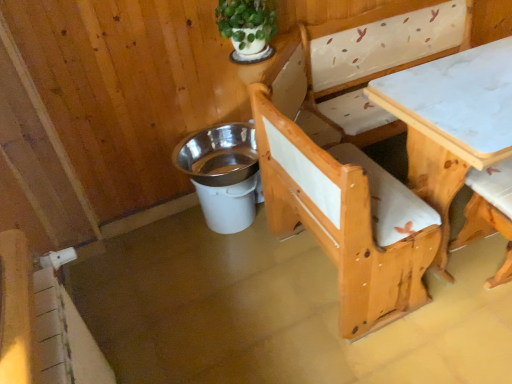
Question: From the image's perspective, is white plastic bucket at lower center located above green matte plant at upper center?

Choices:
 (A) yes
 (B) no

Answer: (B)

Question: From a real-world perspective, is white plastic bucket at lower center on green matte plant at upper center?

Choices:
 (A) yes
 (B) no

Answer: (B)

Question: Can you confirm if white plastic bucket at lower center is smaller than green matte plant at upper center?

Choices:
 (A) no
 (B) yes

Answer: (A)

Question: Can you confirm if white plastic bucket at lower center is thinner than green matte plant at upper center?

Choices:
 (A) yes
 (B) no

Answer: (B)

Question: Is white plastic bucket at lower center not near green matte plant at upper center?

Choices:
 (A) no
 (B) yes

Answer: (A)

Question: Does white plastic bucket at lower center lie in front of green matte plant at upper center?

Choices:
 (A) yes
 (B) no

Answer: (B)

Question: From a real-world perspective, is green matte plant at upper center physically above wooden chair at lower right?

Choices:
 (A) no
 (B) yes

Answer: (B)

Question: From the image's perspective, is green matte plant at upper center located above wooden chair at lower right?

Choices:
 (A) no
 (B) yes

Answer: (B)

Question: Can you confirm if green matte plant at upper center is positioned to the right of wooden chair at lower right?

Choices:
 (A) yes
 (B) no

Answer: (B)

Question: Is green matte plant at upper center turned away from wooden chair at lower right?

Choices:
 (A) yes
 (B) no

Answer: (B)

Question: Is green matte plant at upper center smaller than wooden chair at lower right?

Choices:
 (A) yes
 (B) no

Answer: (A)

Question: Is green matte plant at upper center directly adjacent to wooden chair at lower right?

Choices:
 (A) yes
 (B) no

Answer: (B)

Question: Is green matte plant at upper center further to the viewer compared to white marble table at center?

Choices:
 (A) yes
 (B) no

Answer: (A)